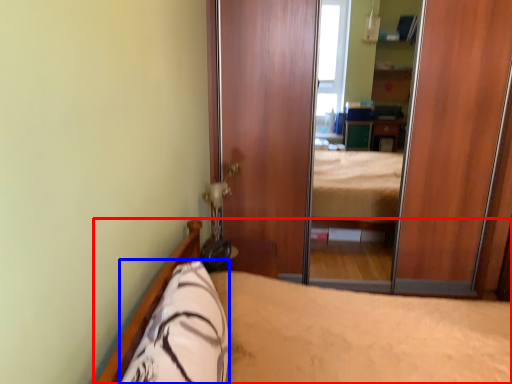
Question: Which object appears closest to the camera in this image, bed (highlighted by a red box) or pillow (highlighted by a blue box)?

Choices:
 (A) bed
 (B) pillow

Answer: (A)